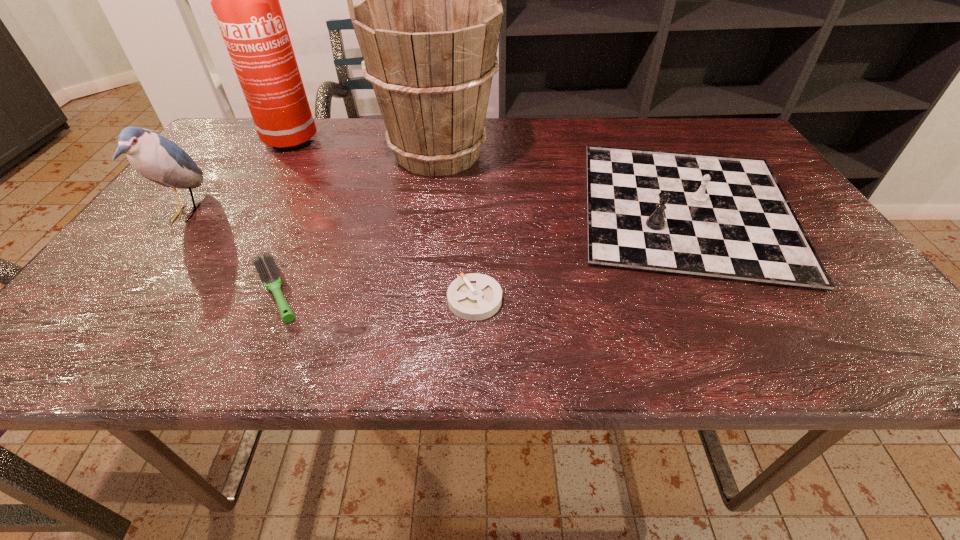
This screenshot has width=960, height=540. In order to click on vacant region located 0.100m at the tip of the third tallest object's beak in this screenshot , I will do `click(248, 213)`.

Where is `vacant space located 0.400m on the left of the fourth tallest object`? This screenshot has width=960, height=540. vacant space located 0.400m on the left of the fourth tallest object is located at coordinates coord(398,209).

Where is `free region located on the back of the fifth tallest object`? This screenshot has width=960, height=540. free region located on the back of the fifth tallest object is located at coordinates (328, 171).

Find the location of a particular element. The width and height of the screenshot is (960, 540). vacant space located 0.090m on the right of the shortest object is located at coordinates (550, 300).

Find the location of a particular element. This screenshot has height=540, width=960. fire extinguisher present at the far edge is located at coordinates (245, 0).

What are the coordinates of `bucket at the far edge` in the screenshot? It's located at (428, 24).

Locate an element on the screen. This screenshot has height=540, width=960. gameboard that is at the far edge is located at coordinates (721, 217).

Where is `hairbrush that is at the near edge`? hairbrush that is at the near edge is located at coordinates (267, 269).

Identify the location of ashtray that is at the near edge. (474, 296).

The image size is (960, 540). I want to click on fire extinguisher that is at the left edge, so click(245, 0).